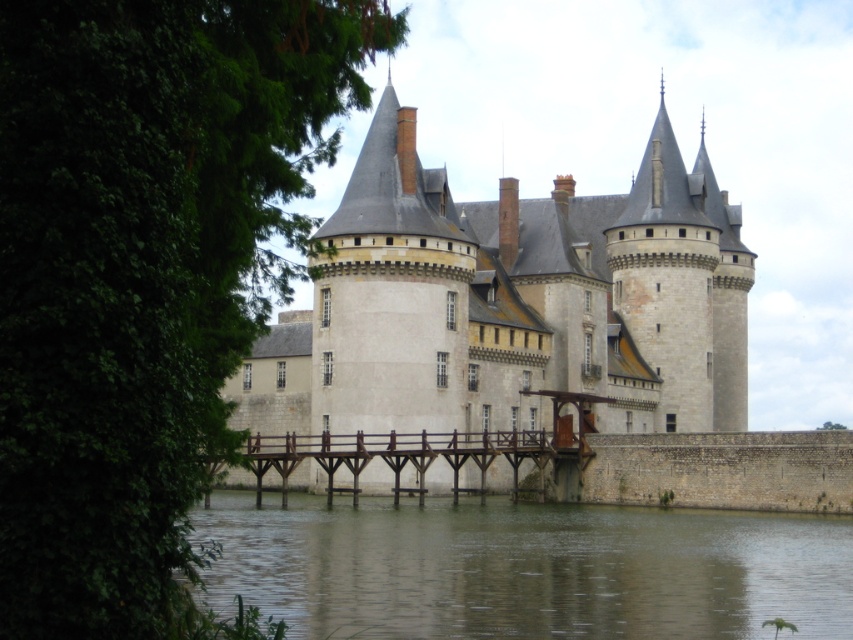
You are a visitor approaching the castle and see the stone gray castle at center and the brown concrete river at lower center. Which object is located higher in the image?

The stone gray castle at center is positioned over the brown concrete river at lower center, so it is higher in the image.

You are an architect planning to build a new pathway from the brown concrete river at lower center to the stone gray castle at center. Based on their positions, which direction should the pathway go to avoid crossing the river?

The pathway should go around the stone gray castle at center since the brown concrete river at lower center is behind it, meaning the river is located behind the castle and not in front. Therefore, the pathway can be constructed around the castle to avoid crossing the river.

You are planning to cross the brown concrete river at lower center to reach the stone gray castle at center. Based on their sizes, which one do you think is bigger?

The stone gray castle at center is larger in size than the brown concrete river at lower center, so the castle is bigger.